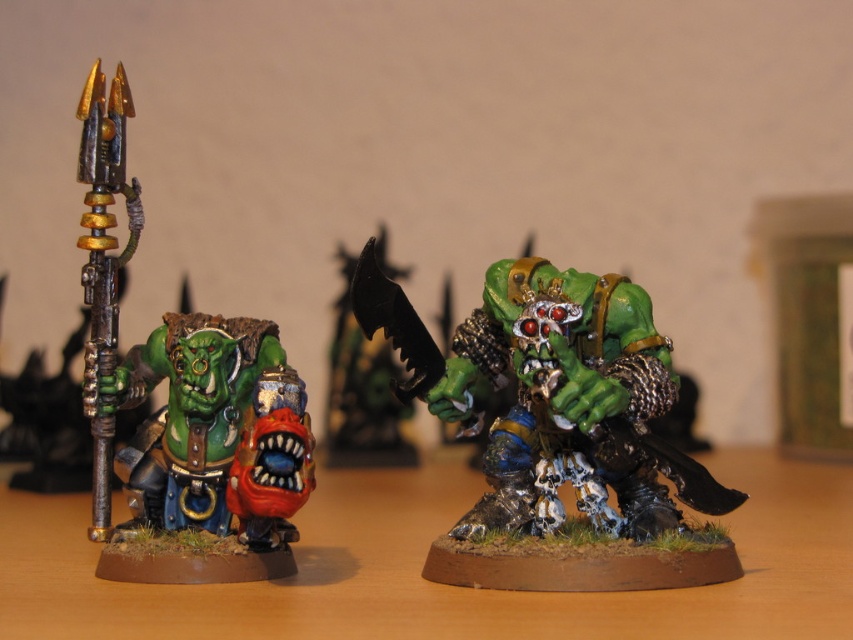
Between point (721, 548) and point (206, 524), which one is positioned behind?

The point (206, 524) is behind.

Is green metallic armor at center shorter than green matte orc head at center?

No.

Is point (554, 394) in front of point (276, 474)?

No, (554, 394) is further to viewer.

You are a GUI agent. You are given a task and a screenshot of the screen. Output one action in this format:
    pyautogui.click(x=<x>, y=<y>)
    Task: Click on the green metallic armor at center
    The image size is (853, 640).
    Given the screenshot: What is the action you would take?
    pyautogui.click(x=558, y=432)